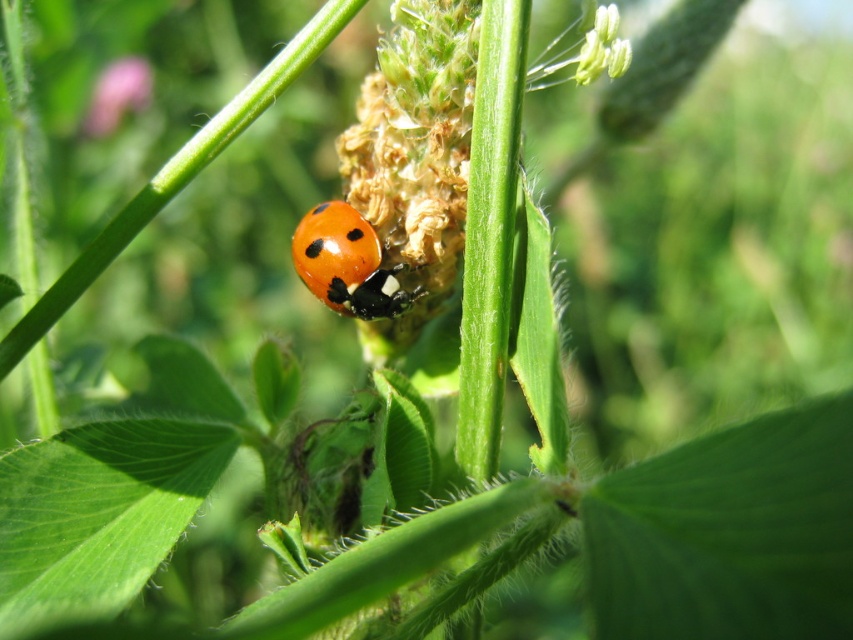
Question: Where is shiny orange ladybird at center located in relation to smooth pink flower at upper left in the image?

Choices:
 (A) below
 (B) above

Answer: (A)

Question: Can you confirm if shiny orange ladybird at center is smaller than smooth pink flower at upper left?

Choices:
 (A) no
 (B) yes

Answer: (B)

Question: Which point is closer to the camera?

Choices:
 (A) (346, 211)
 (B) (115, 76)

Answer: (A)

Question: Can you confirm if shiny orange ladybird at center is bigger than smooth pink flower at upper left?

Choices:
 (A) yes
 (B) no

Answer: (B)